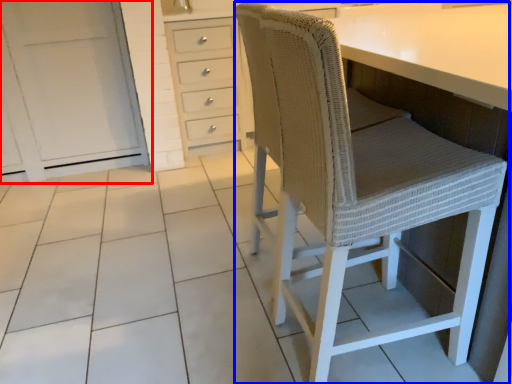
Question: Which point is closer to the camera, cabinetry (highlighted by a red box) or chair (highlighted by a blue box)?

Choices:
 (A) cabinetry
 (B) chair

Answer: (B)